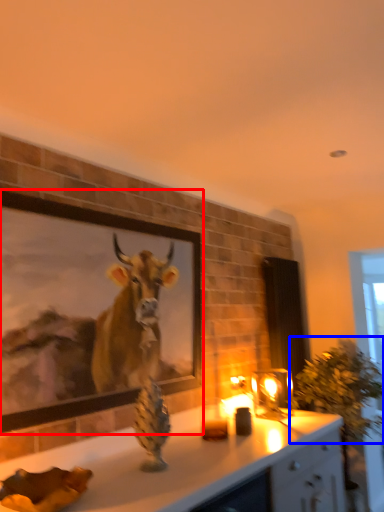
Question: Which object is closer to the camera taking this photo, picture frame (highlighted by a red box) or plant (highlighted by a blue box)?

Choices:
 (A) picture frame
 (B) plant

Answer: (A)